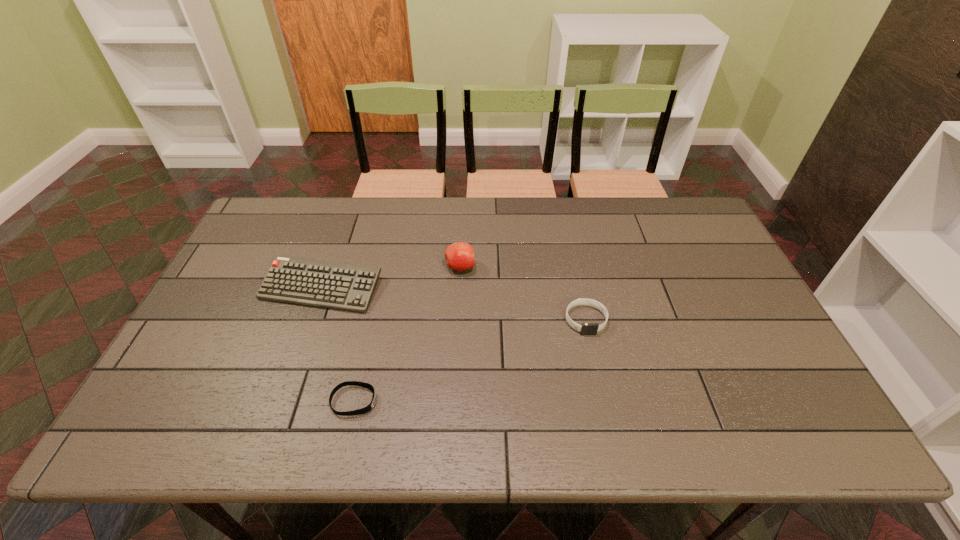
The height and width of the screenshot is (540, 960). In order to click on free space between the rightmost object and the nearer wristband in this screenshot , I will do `click(469, 361)`.

Locate an element on the screen. This screenshot has width=960, height=540. free space between the shortest object and the apple is located at coordinates (407, 334).

This screenshot has width=960, height=540. Find the location of `unoccupied area between the left wristband and the tallest object`. unoccupied area between the left wristband and the tallest object is located at coordinates (407, 334).

Locate an element on the screen. free space between the third tallest object and the left wristband is located at coordinates (469, 361).

Find the location of `unoccupied area between the nearer wristband and the rightmost object`. unoccupied area between the nearer wristband and the rightmost object is located at coordinates (469, 361).

What are the coordinates of `vacant point located between the tallest object and the shortest object` in the screenshot? It's located at (407, 334).

What are the coordinates of `vacant area that lies between the computer keyboard and the shorter wristband` in the screenshot? It's located at (338, 345).

Image resolution: width=960 pixels, height=540 pixels. Find the location of `vacant area between the left wristband and the taller wristband`. vacant area between the left wristband and the taller wristband is located at coordinates (469, 361).

Select which object appears as the second closest to the third object from left to right. Please provide its 2D coordinates. Your answer should be formatted as a tuple, i.e. [(x, y)], where the tuple contains the x and y coordinates of a point satisfying the conditions above.

[(586, 328)]

The height and width of the screenshot is (540, 960). I want to click on the second closest object to the computer keyboard, so click(x=368, y=408).